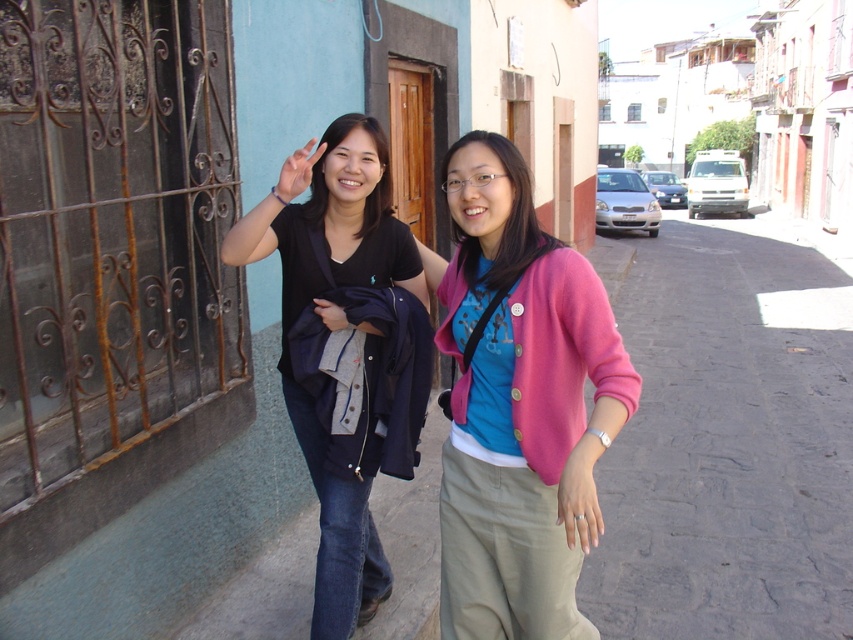
Question: Which object is farther from the camera taking this photo?

Choices:
 (A) black matte t-shirt at center
 (B) pink fabric cardigan at center

Answer: (A)

Question: Can you confirm if pink fabric cardigan at center is thinner than black matte t-shirt at center?

Choices:
 (A) yes
 (B) no

Answer: (A)

Question: From the image, what is the correct spatial relationship of pink fabric cardigan at center in relation to black matte t-shirt at center?

Choices:
 (A) left
 (B) right

Answer: (B)

Question: Does pink fabric cardigan at center have a lesser width compared to black matte t-shirt at center?

Choices:
 (A) no
 (B) yes

Answer: (B)